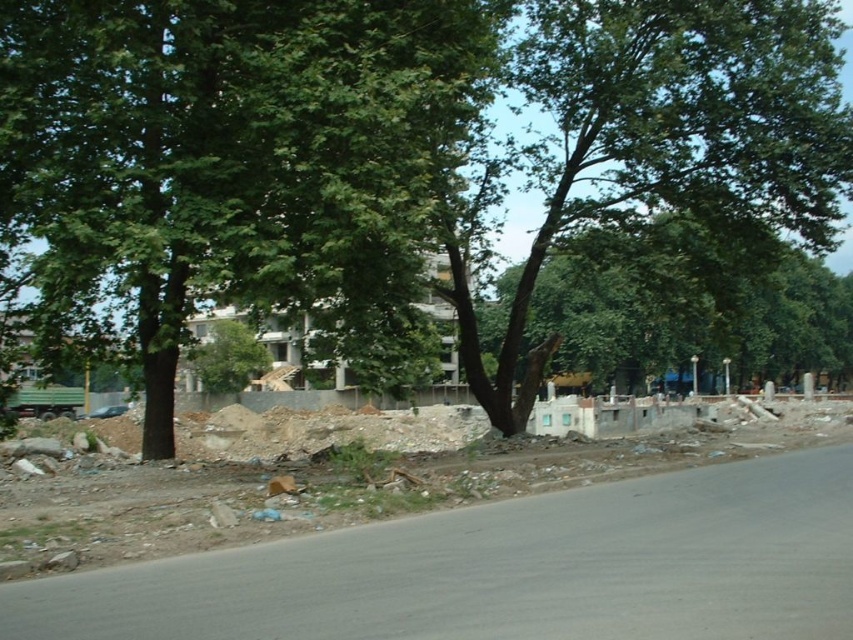
Does concrete rubble at center have a greater width compared to green leafy tree at upper left?

No.

Can you confirm if concrete rubble at center is positioned to the right of green leafy tree at upper left?

No, concrete rubble at center is not to the right of green leafy tree at upper left.

Find the location of `concrete rubble at center`. concrete rubble at center is located at coordinates (456, 541).